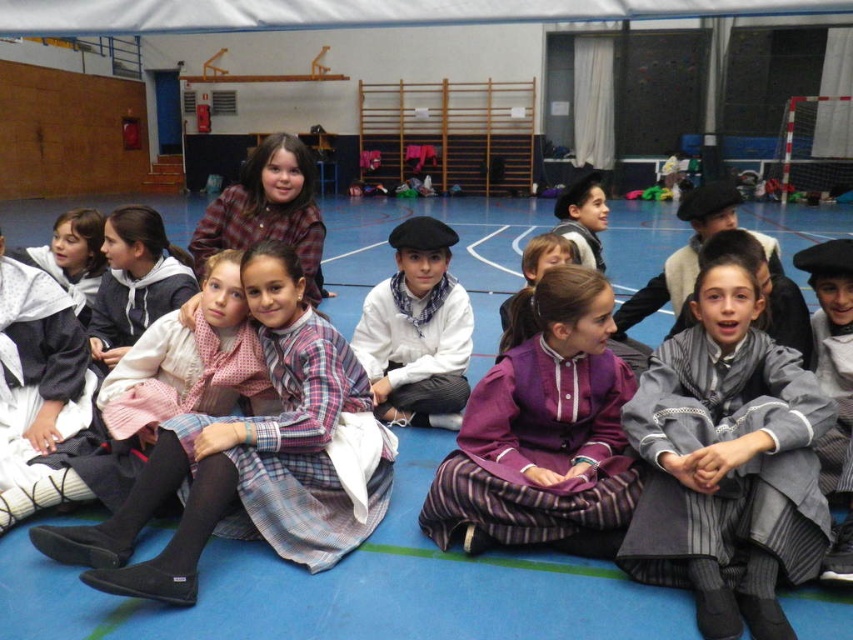
Between striped wool dress at center and plaid fabric dress at center, which one has less height?

plaid fabric dress at center is shorter.

Between point (775, 404) and point (281, 554), which one is positioned in front?

Point (281, 554) is in front.

Is point (727, 499) farther from viewer compared to point (143, 509)?

Yes.

The image size is (853, 640). I want to click on striped wool dress at center, so click(x=727, y=458).

Between striped wool dress at center and white matte shirt at center, which one is positioned higher?

white matte shirt at center is higher up.

The width and height of the screenshot is (853, 640). Identify the location of striped wool dress at center. (727, 458).

Is point (733, 336) closer to camera compared to point (396, 378)?

That is True.

I want to click on striped wool dress at center, so click(x=727, y=458).

Who is higher up, striped wool dress at center or plaid fabric shirt at upper center?

plaid fabric shirt at upper center

Does striped wool dress at center have a smaller size compared to plaid fabric shirt at upper center?

Actually, striped wool dress at center might be larger than plaid fabric shirt at upper center.

Does point (746, 388) come in front of point (305, 220)?

Yes, point (746, 388) is in front of point (305, 220).

You are a GUI agent. You are given a task and a screenshot of the screen. Output one action in this format:
    pyautogui.click(x=<x>, y=<y>)
    Task: Click on the striped wool dress at center
    Image resolution: width=853 pixels, height=640 pixels.
    Given the screenshot: What is the action you would take?
    pyautogui.click(x=727, y=458)